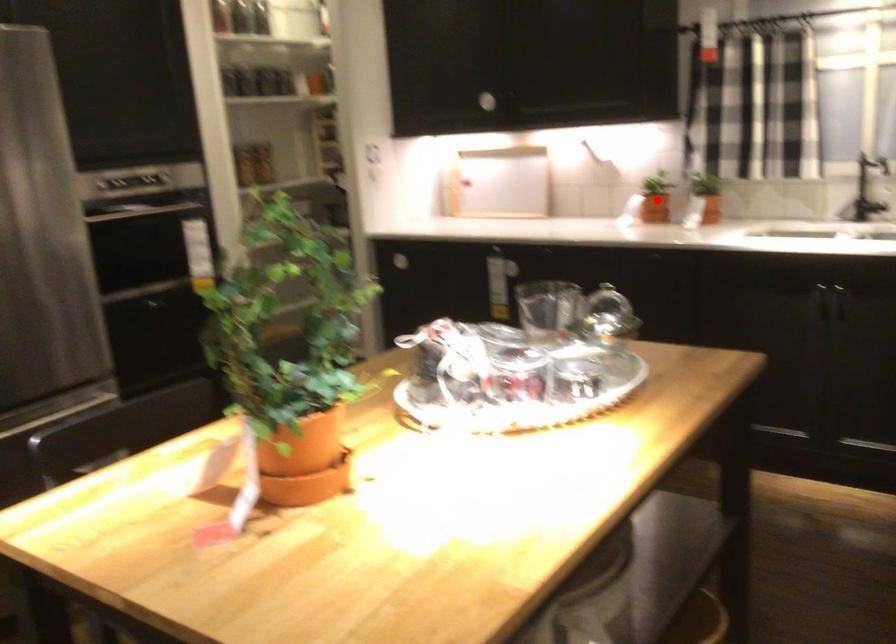
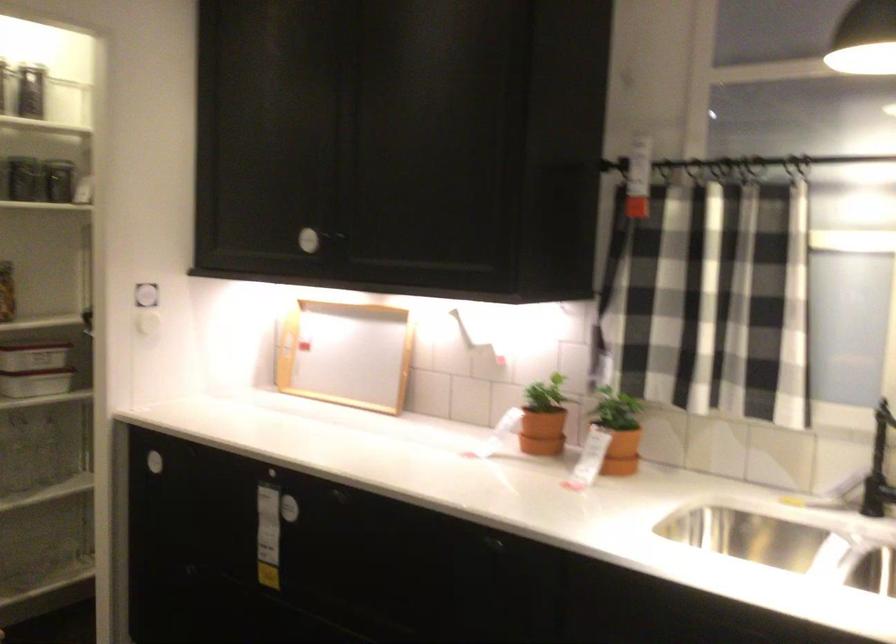
Question: I am providing you with two images of the same scene from different viewpoints. A red point is shown in image1. For the corresponding object point in image2, is it positioned nearer or farther from the camera?

Choices:
 (A) Nearer
 (B) Farther

Answer: (A)